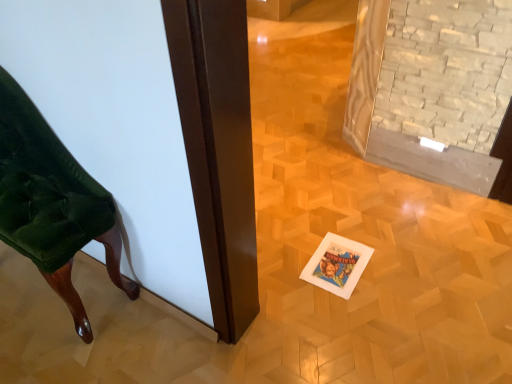
This screenshot has height=384, width=512. What are the coordinates of `vacant space underneath velvet green chair at left (from a real-world perspective)` in the screenshot? It's located at (51, 289).